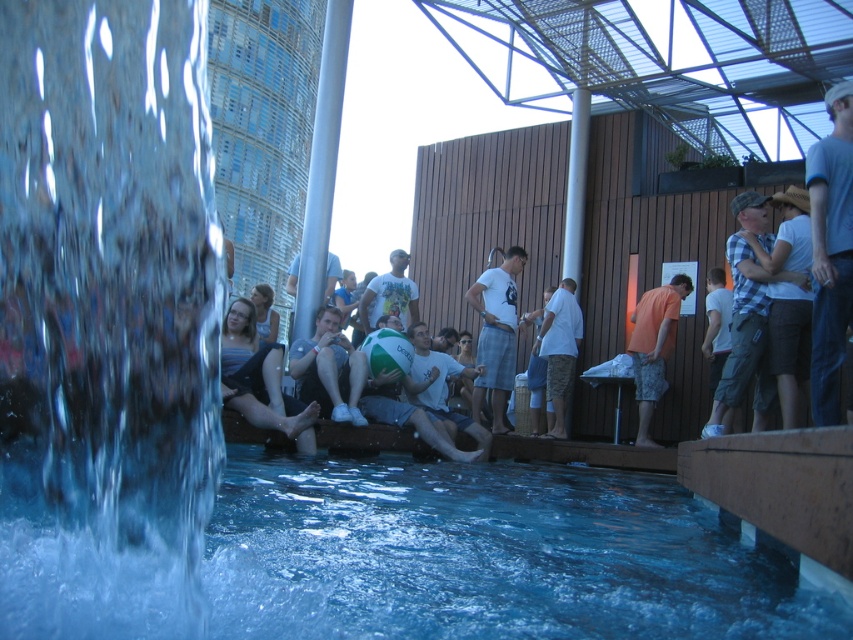
Question: Which point is closer to the camera taking this photo?

Choices:
 (A) (390, 269)
 (B) (262, 400)

Answer: (B)

Question: Can you confirm if blue denim shorts at lower left is thinner than white fabric shorts at center?

Choices:
 (A) no
 (B) yes

Answer: (A)

Question: Based on their relative distances, which object is nearer to the light blue denim shorts at center?

Choices:
 (A) blue denim shorts at lower left
 (B) clear liquid water at left

Answer: (A)

Question: Estimate the real-world distances between objects in this image. Which object is closer to the white cotton t-shirt at center?

Choices:
 (A) white cotton shirt at upper right
 (B) white fabric shorts at center
 (C) blue denim shorts at lower left
 (D) clear blue water at lower center

Answer: (B)

Question: Does white cotton t-shirt at center have a smaller size compared to white cotton shirt at center?

Choices:
 (A) no
 (B) yes

Answer: (B)

Question: Does clear blue water at lower center have a larger size compared to white cotton shirt at center?

Choices:
 (A) yes
 (B) no

Answer: (B)